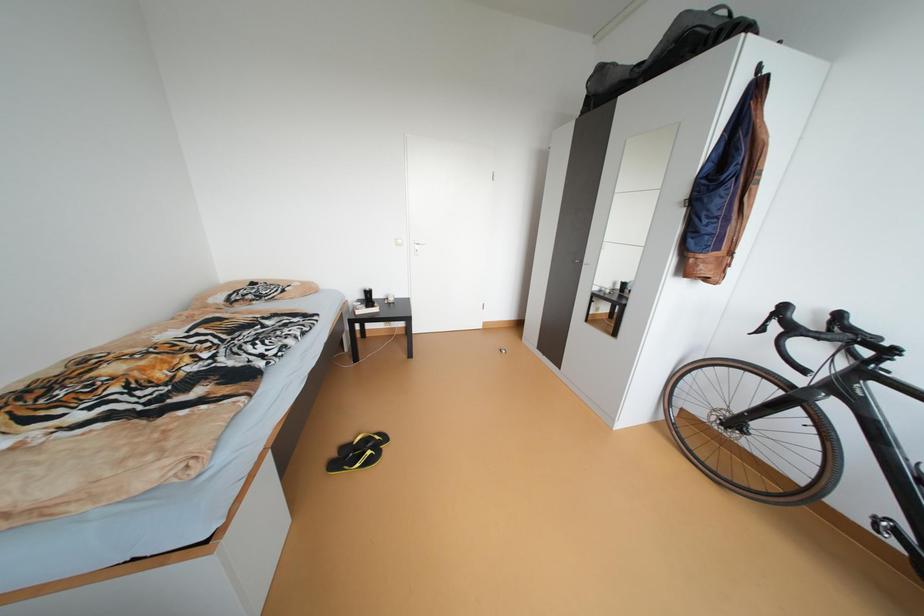
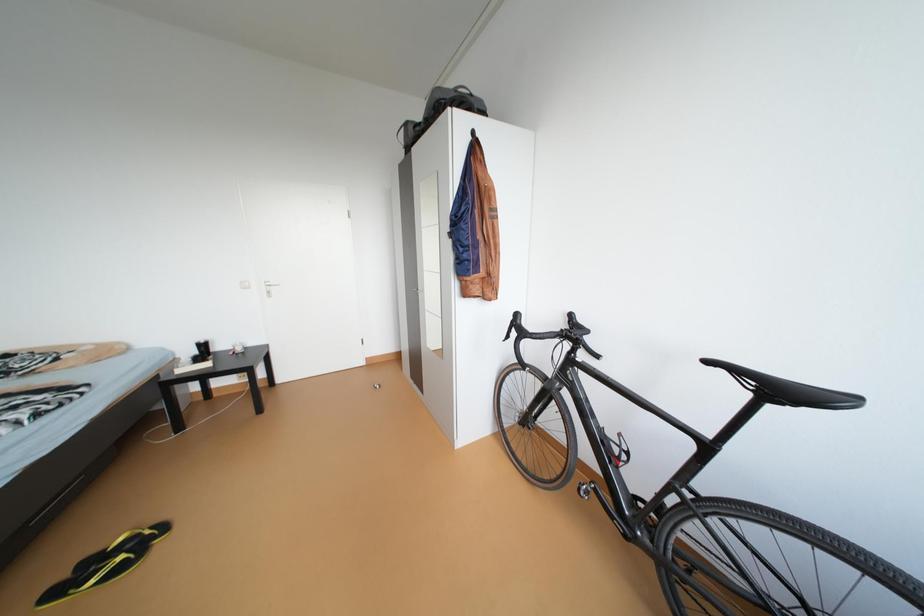
Question: Based on the continuous images, in which direction is the camera rotating? Reply with the corresponding letter.

Choices:
 (A) Left
 (B) Right
 (C) Up
 (D) Down

Answer: (B)